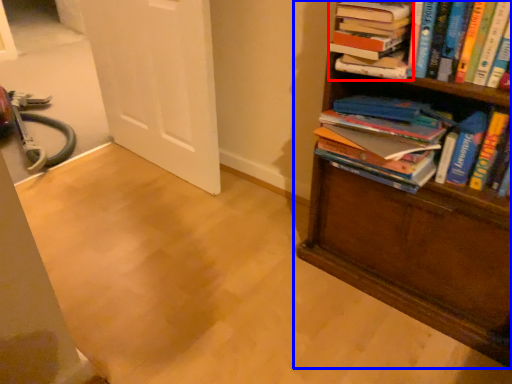
Question: Which of the following is the closest to the observer, book (highlighted by a red box) or bookcase (highlighted by a blue box)?

Choices:
 (A) book
 (B) bookcase

Answer: (B)